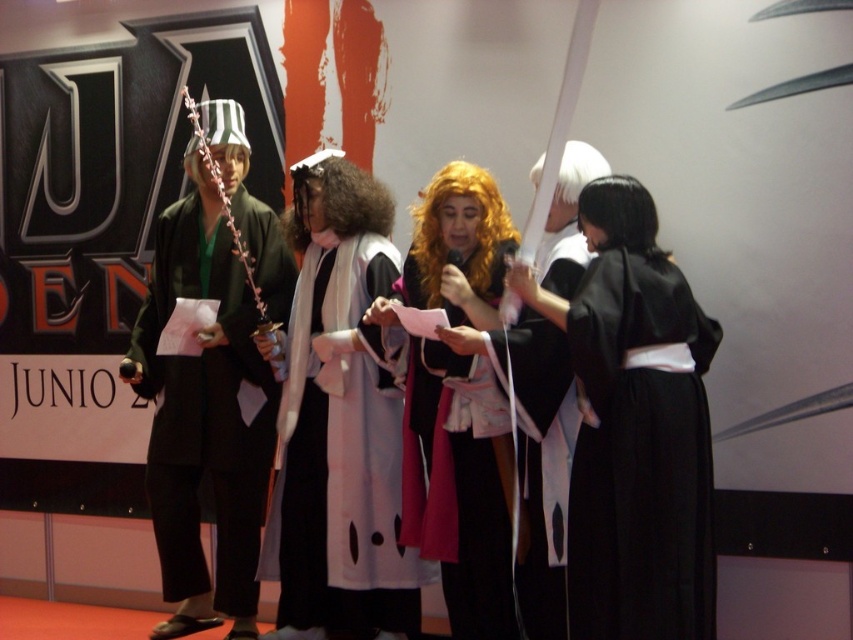
You are a photographer at a cosplay event. You need to capture a photo of the curly brown wig at center and the black silky wig at right. According to their positions, which wig is located more to the left?

The curly brown wig at center is positioned more to the left than the black silky wig at right.

You are organizing a photoshoot for a magazine and need to arrange two cosplayers wearing the black silk kimono at right and the white matte kimono at center. The editor wants the smaller kimono to be placed closer to the camera to emphasize its elegance. Which cosplayer should you position nearer to the camera?

The black silk kimono at right is smaller in size compared to the white matte kimono at center, so you should position the cosplayer wearing the black silk kimono at right closer to the camera to highlight its elegance.